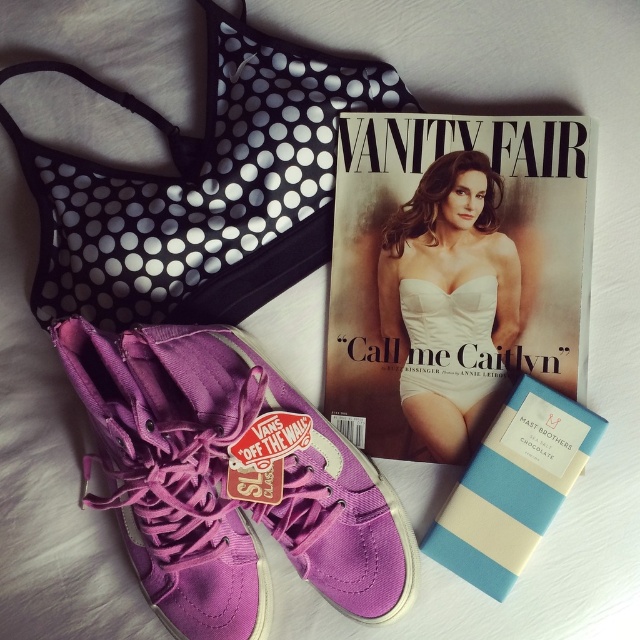
Question: Does purple canvas sneaker at center lie in front of white satin dress at center?

Choices:
 (A) no
 (B) yes

Answer: (B)

Question: Which object is farther from the camera taking this photo?

Choices:
 (A) purple canvas sneaker at center
 (B) black dotted bikini top at upper left

Answer: (B)

Question: Where is purple canvas sneaker at center located in relation to white satin dress at center in the image?

Choices:
 (A) below
 (B) above

Answer: (A)

Question: Which point is farther to the camera?

Choices:
 (A) black dotted bikini top at upper left
 (B) matte white magazine at center
 (C) purple canvas sneaker at center
 (D) white satin dress at center

Answer: (D)

Question: Which point is closer to the camera taking this photo?

Choices:
 (A) (449, 333)
 (B) (500, 445)

Answer: (B)

Question: Does purple canvas sneaker at center appear under blue striped chocolate bar at center?

Choices:
 (A) yes
 (B) no

Answer: (B)